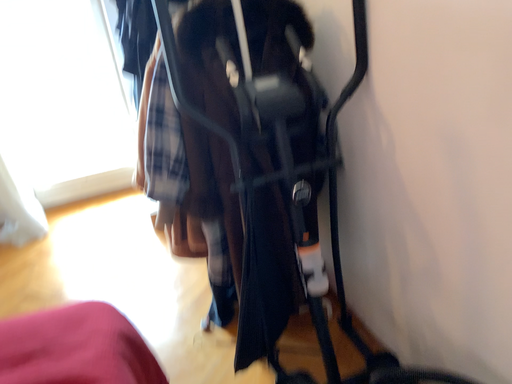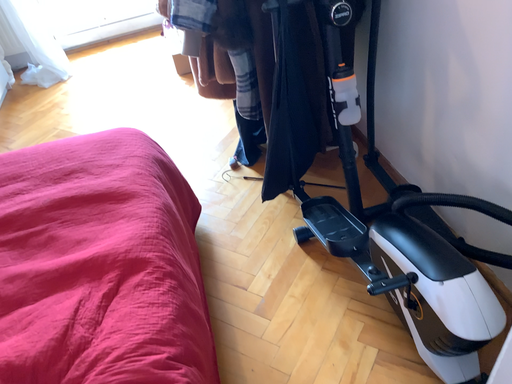
Question: Which way did the camera rotate in the video?

Choices:
 (A) rotated upward
 (B) rotated downward

Answer: (B)